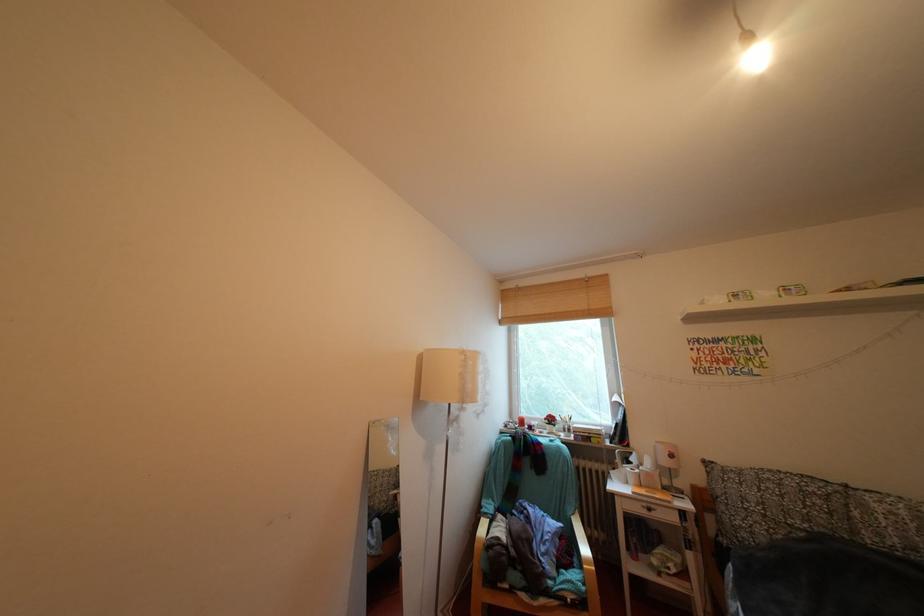
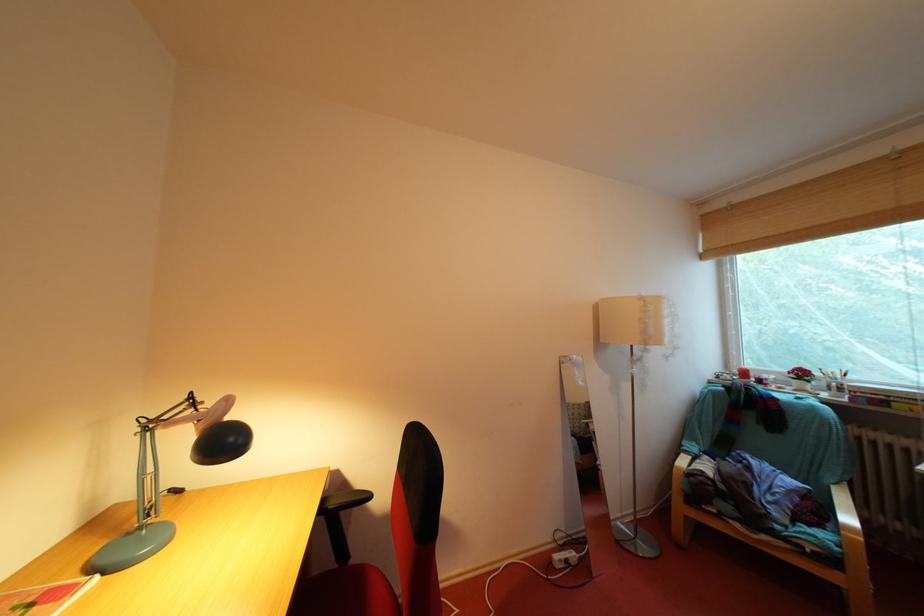
Locate, in the second image, the point that corresponds to (599,565) in the first image.

(861, 535)